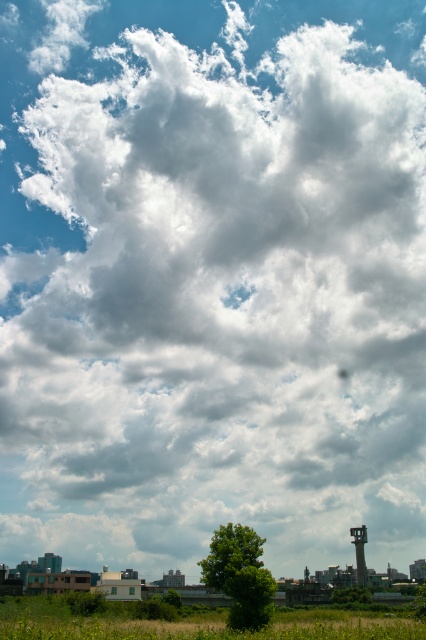
You are standing in the field and see the green grass at lower center and the green matte tree at lower center. Which one is more to the left?

The green grass at lower center is more to the left because it is positioned on the left side of the green matte tree at lower center.

You are a gardener who wants to mow the green grass at lower center but need to avoid the green matte tree at lower center. Which one is taller so you know where to avoid?

The green grass at lower center is much taller than the green matte tree at lower center, so you should avoid the area where the green grass at lower center is located.